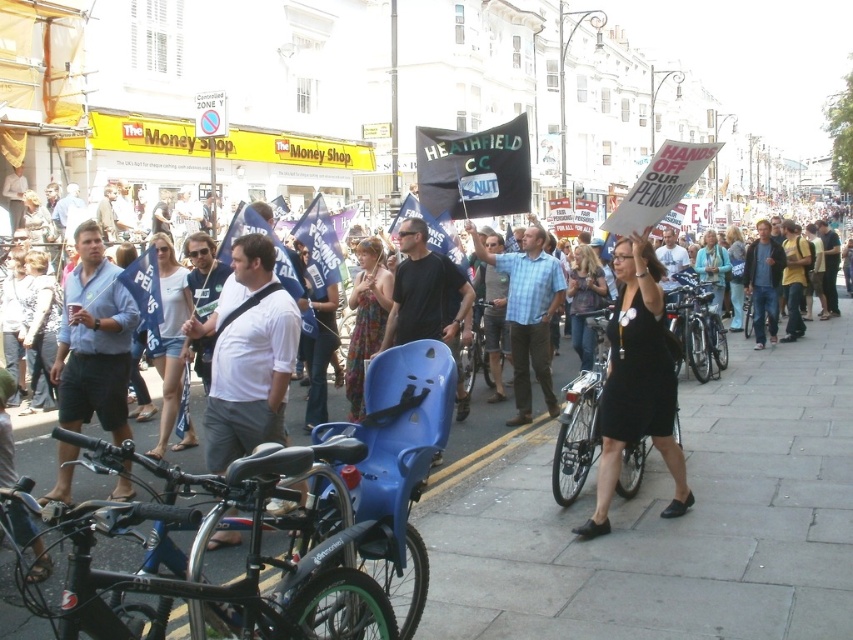
Which is above, light blue shirt at center or plaid fabric shirt at center?

plaid fabric shirt at center

Based on the photo, can you confirm if light blue shirt at center is positioned to the left of plaid fabric shirt at center?

Correct, you'll find light blue shirt at center to the left of plaid fabric shirt at center.

Does point (115, 276) lie in front of point (535, 280)?

Yes, it is.

Find the location of a particular element. The width and height of the screenshot is (853, 640). light blue shirt at center is located at coordinates (94, 340).

Is smooth concrete pavement at center closer to camera compared to black matte bicycle at center?

Yes, smooth concrete pavement at center is in front of black matte bicycle at center.

Based on the photo, is smooth concrete pavement at center above black matte bicycle at center?

No.

Between point (428, 609) and point (457, 412), which one is positioned behind?

Positioned behind is point (457, 412).

Where is `smooth concrete pavement at center`? This screenshot has height=640, width=853. smooth concrete pavement at center is located at coordinates (666, 522).

Is smooth concrete pavement at center further to the viewer compared to light blue shirt at center?

No, smooth concrete pavement at center is in front of light blue shirt at center.

Does smooth concrete pavement at center have a lesser width compared to light blue shirt at center?

No, smooth concrete pavement at center is not thinner than light blue shirt at center.

Who is more forward, (695, 438) or (115, 444)?

Point (115, 444) is in front.

Locate an element on the screen. smooth concrete pavement at center is located at coordinates (666, 522).